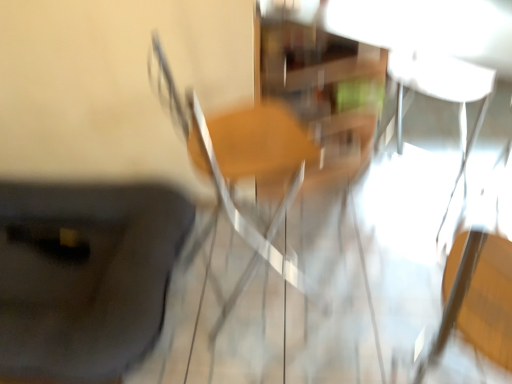
Question: In terms of width, does black matte suitcase at lower left look wider or thinner when compared to wooden chair at center?

Choices:
 (A) wide
 (B) thin

Answer: (A)

Question: Is black matte suitcase at lower left in front of or behind wooden chair at center in the image?

Choices:
 (A) front
 (B) behind

Answer: (B)

Question: Based on their positions, is black matte suitcase at lower left located to the left or right of wooden chair at center?

Choices:
 (A) right
 (B) left

Answer: (B)

Question: Considering the positions of point (266, 251) and point (3, 291), is point (266, 251) closer or farther from the camera than point (3, 291)?

Choices:
 (A) farther
 (B) closer

Answer: (A)

Question: Based on their positions, is wooden chair at center located to the left or right of black matte suitcase at lower left?

Choices:
 (A) right
 (B) left

Answer: (A)

Question: Relative to black matte suitcase at lower left, is wooden chair at center in front or behind?

Choices:
 (A) front
 (B) behind

Answer: (A)

Question: Is wooden chair at center taller or shorter than black matte suitcase at lower left?

Choices:
 (A) short
 (B) tall

Answer: (B)